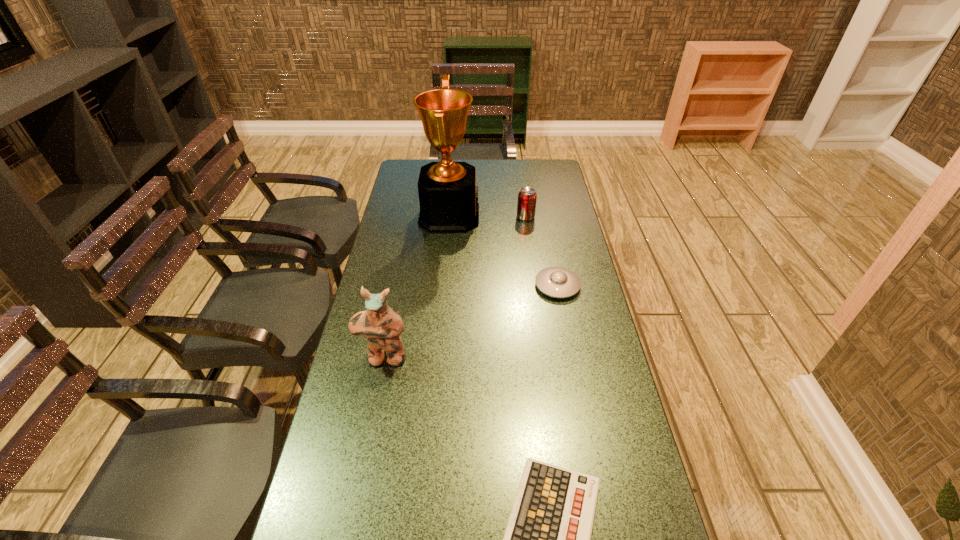
The height and width of the screenshot is (540, 960). I want to click on the tallest object, so click(x=448, y=196).

Locate an element on the screen. The height and width of the screenshot is (540, 960). the fourth shortest object is located at coordinates (381, 325).

This screenshot has height=540, width=960. Find the location of `the second nearest object`. the second nearest object is located at coordinates (381, 325).

The height and width of the screenshot is (540, 960). Identify the location of the third shortest object. (526, 205).

Identify the location of the third nearest object. This screenshot has height=540, width=960. (558, 282).

I want to click on the fourth tallest object, so click(558, 282).

At what (x,y) coordinates should I click in order to perform the action: click on free point located on the front of the trophy cup with the label. Please return your answer as a coordinate pair (x, y). Looking at the image, I should click on (517, 215).

The width and height of the screenshot is (960, 540). I want to click on vacant space positioned 0.070m on the front-facing side of the figurine, so click(x=377, y=391).

You are a GUI agent. You are given a task and a screenshot of the screen. Output one action in this format:
    pyautogui.click(x=<x>, y=<y>)
    Task: Click on the free space located on the front of the third shortest object
    
    Given the screenshot: What is the action you would take?
    pyautogui.click(x=531, y=256)

What are the coordinates of `free location located 0.350m on the front of the third farthest object` in the screenshot? It's located at (578, 393).